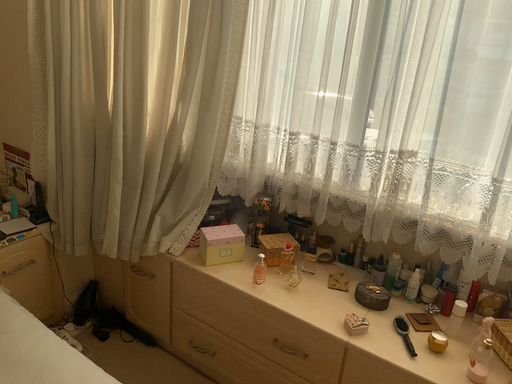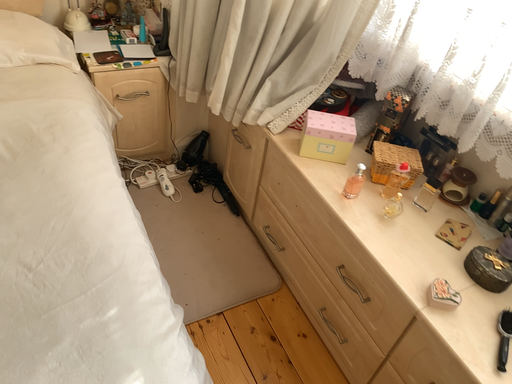
Question: How did the camera likely rotate when shooting the video?

Choices:
 (A) rotated right
 (B) rotated left

Answer: (B)